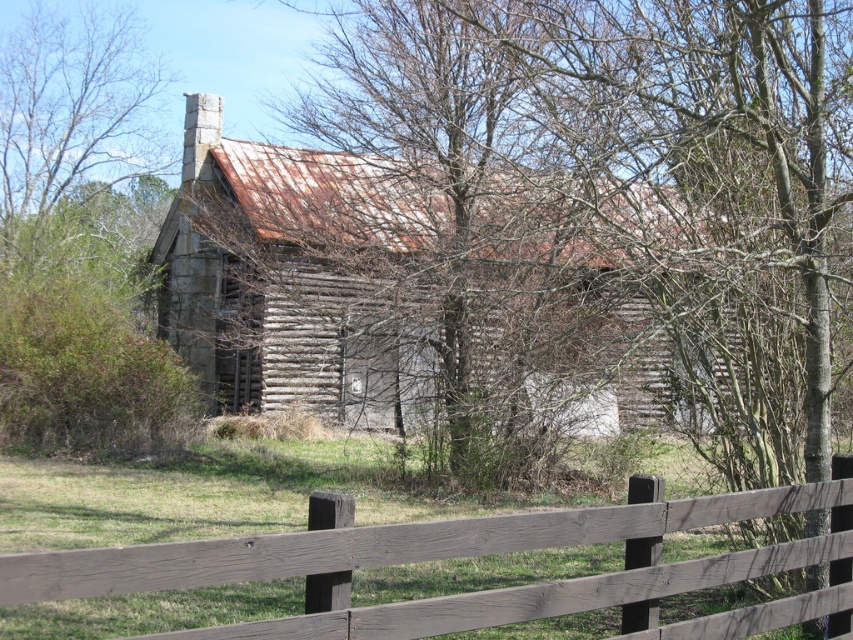
You are standing at the point marked by coordinates point (x=306, y=276). Based on the scene described, what structure are you currently positioned at?

You are positioned at the rusty wood cabin at center, as the point (x=306, y=276) represents its location according to the description.

You are a painter who needs to decide which object to paint first between the rusty wood cabin at center and the brown wooden fence at lower center. If you want to start with the wider object, which one should you choose?

The rusty wood cabin at center is wider than the brown wooden fence at lower center, so you should start painting the rusty wood cabin at center first.

You are a painter who wants to paint both the rusty wood cabin at center and the brown wooden fence at lower center. Based on their sizes, which one will require more paint?

The rusty wood cabin at center is bigger than the brown wooden fence at lower center, so it will require more paint.